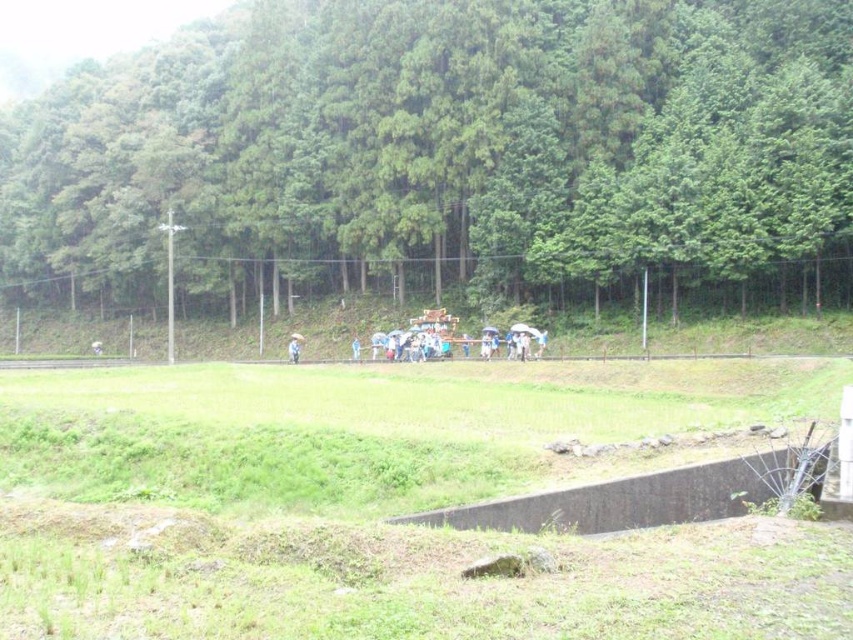
Question: Can you confirm if green leafy trees at upper center is bigger than blue fabric umbrella at center?

Choices:
 (A) no
 (B) yes

Answer: (B)

Question: Can you confirm if green leafy trees at upper center is wider than blue fabric umbrella at center?

Choices:
 (A) no
 (B) yes

Answer: (B)

Question: Can you confirm if white fabric umbrella at center is wider than blue fabric umbrella at center?

Choices:
 (A) yes
 (B) no

Answer: (A)

Question: Which object is positioned farthest from the blue fabric umbrella at center?

Choices:
 (A) green leafy trees at upper center
 (B) white fabric umbrella at center

Answer: (A)

Question: Which of the following is the farthest from the observer?

Choices:
 (A) white fabric umbrella at center
 (B) blue fabric umbrella at center

Answer: (B)

Question: Which point is closer to the camera taking this photo?

Choices:
 (A) (291, 337)
 (B) (582, 17)
 (C) (352, 358)

Answer: (C)